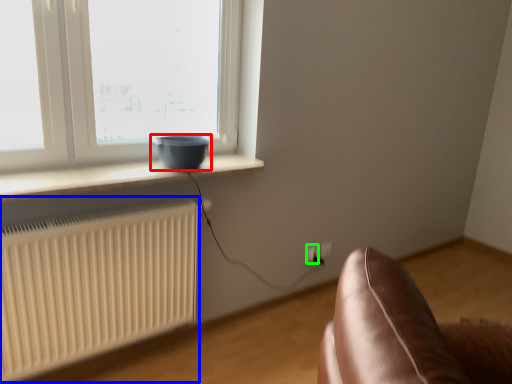
Question: Which object is positioned closest to bowl (highlighted by a red box)? Select from radiator (highlighted by a blue box) and electric outlet (highlighted by a green box).

Choices:
 (A) radiator
 (B) electric outlet

Answer: (A)